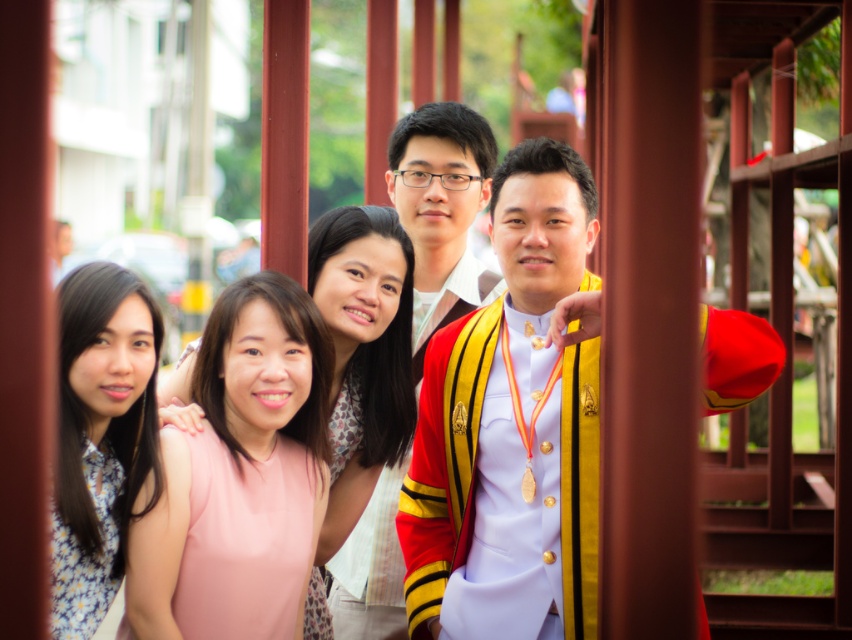
You are a photographer taking a group photo and need to ensure that both the yellow striped sash at center and the pink fabric dress at center are visible. Given their positions, which one might be partially obscured if they are standing too close to each other?

The pink fabric dress at center might be partially obscured because the yellow striped sash at center is taller than it.

You are a photographer at a graduation ceremony. You need to arrange the red velvet suit at center and the pink fabric dress at center so that both are visible in the photo. Which one should be placed in front to ensure both are fully visible?

The red velvet suit at center is shorter than the pink fabric dress at center. To ensure both are fully visible in the photo, the shorter red velvet suit at center should be placed in front so that it doesn not block the view of the taller pink fabric dress at center.